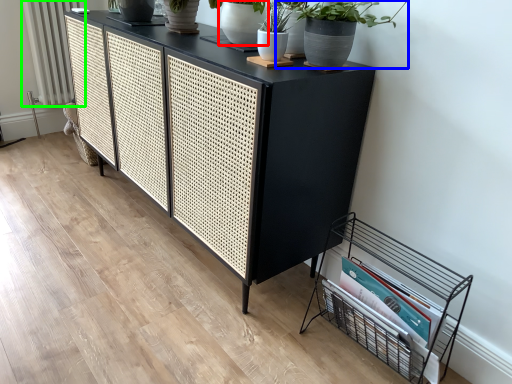
Question: Considering the real-world distances, which object is farthest from flowerpot (highlighted by a red box)? houseplant (highlighted by a blue box) or radiator (highlighted by a green box)?

Choices:
 (A) houseplant
 (B) radiator

Answer: (B)